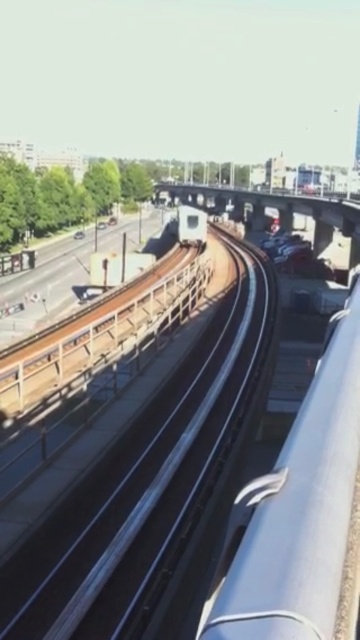
Between smooth steel train track at center and white glossy train at center, which one appears on the right side from the viewer's perspective?

From the viewer's perspective, white glossy train at center appears more on the right side.

Does smooth steel train track at center have a smaller size compared to white glossy train at center?

Yes.

The height and width of the screenshot is (640, 360). Find the location of `smooth steel train track at center`. smooth steel train track at center is located at coordinates (150, 483).